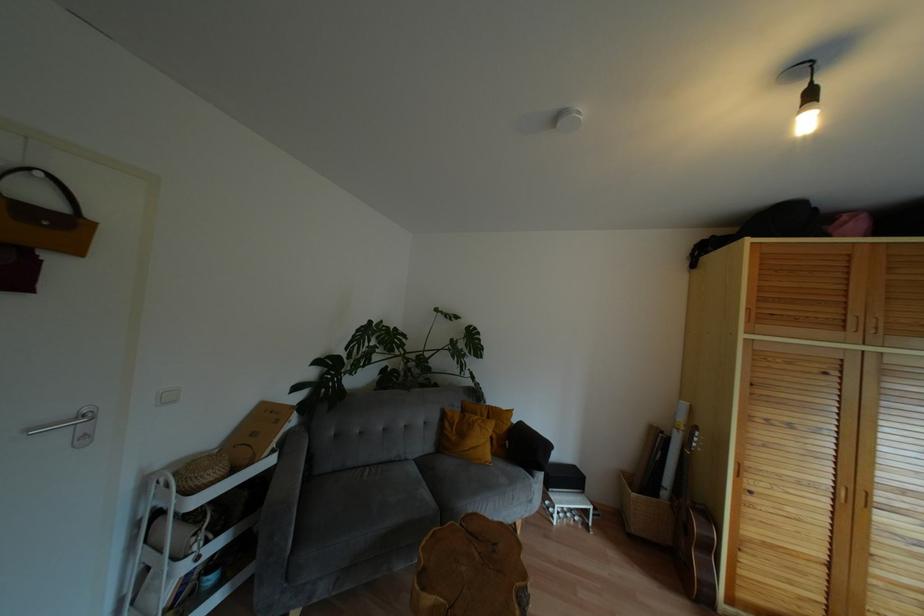
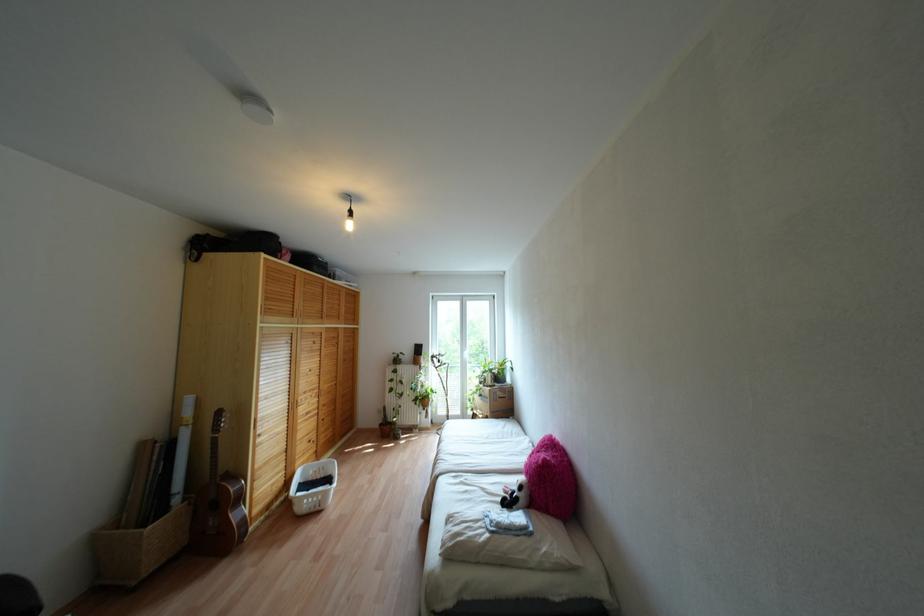
In the second image, find the point that corresponds to point 806,123 in the first image.

(348, 225)